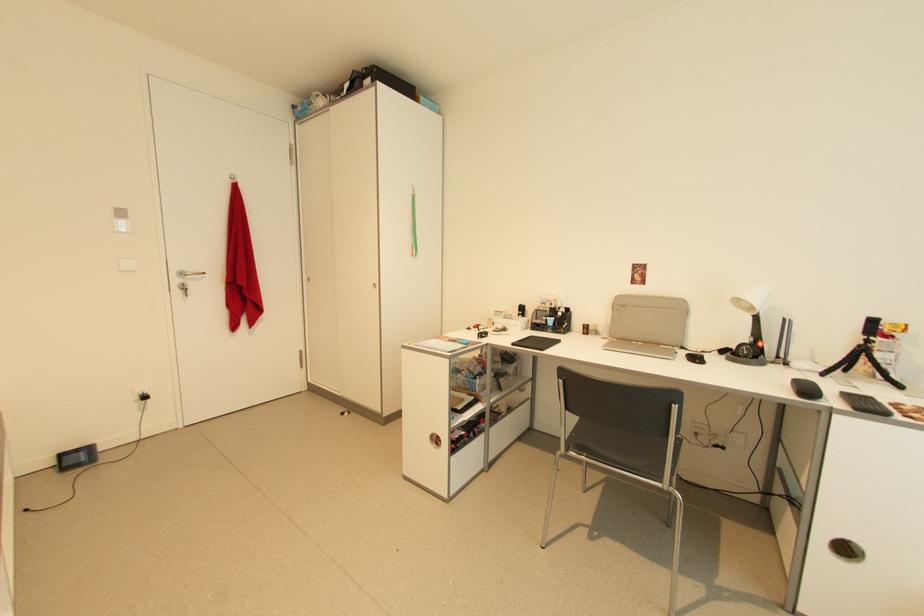
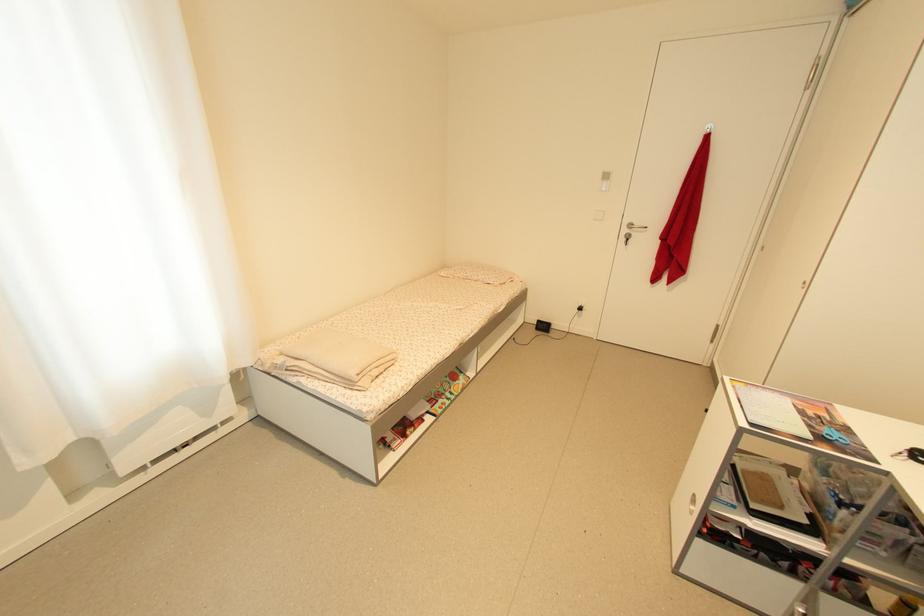
Find the pixel in the second image that matches point (183, 293) in the first image.

(627, 241)